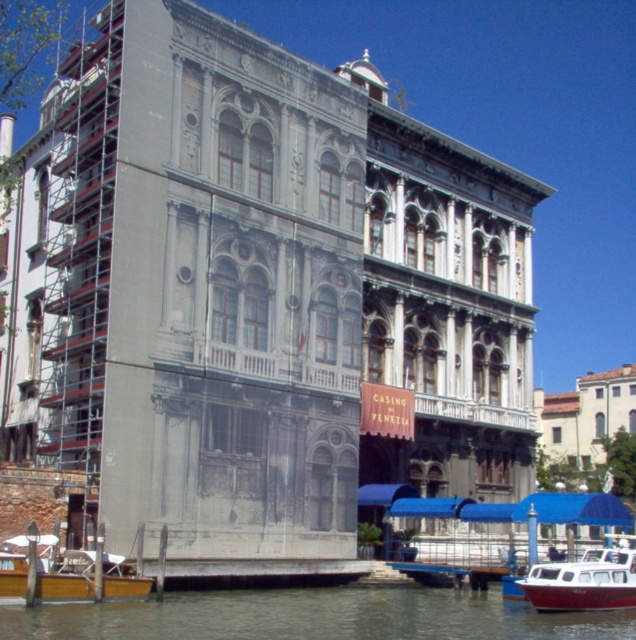
Is greenish water at lower center above wooden polished boat at lower left?

No.

Can you confirm if greenish water at lower center is taller than wooden polished boat at lower left?

Yes.

What do you see at coordinates (314, 616) in the screenshot?
I see `greenish water at lower center` at bounding box center [314, 616].

Identify the location of greenish water at lower center. (314, 616).

In the scene shown: Is the position of wooden polished boat at lower left more distant than that of white plastic boat at lower right?

No, wooden polished boat at lower left is in front of white plastic boat at lower right.

Is point (4, 547) positioned after point (588, 602)?

That is False.

Image resolution: width=636 pixels, height=640 pixels. I want to click on wooden polished boat at lower left, so click(66, 579).

Who is more distant from viewer, (322,593) or (597,604)?

Positioned behind is point (322,593).

Does greenish water at lower center appear on the right side of white plastic boat at lower right?

No, greenish water at lower center is not to the right of white plastic boat at lower right.

You are a GUI agent. You are given a task and a screenshot of the screen. Output one action in this format:
    pyautogui.click(x=<x>, y=<y>)
    Task: Click on the greenish water at lower center
    
    Given the screenshot: What is the action you would take?
    pyautogui.click(x=314, y=616)